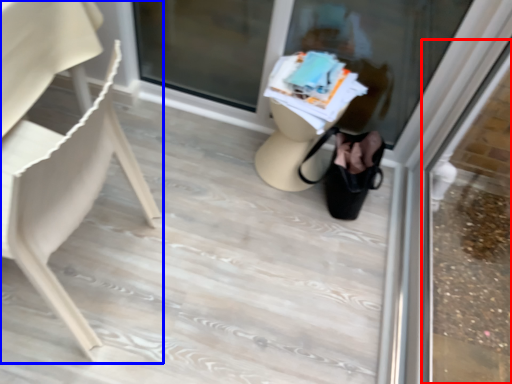
Question: Among these objects, which one is nearest to the camera, shop window (highlighted by a red box) or chair (highlighted by a blue box)?

Choices:
 (A) shop window
 (B) chair

Answer: (A)